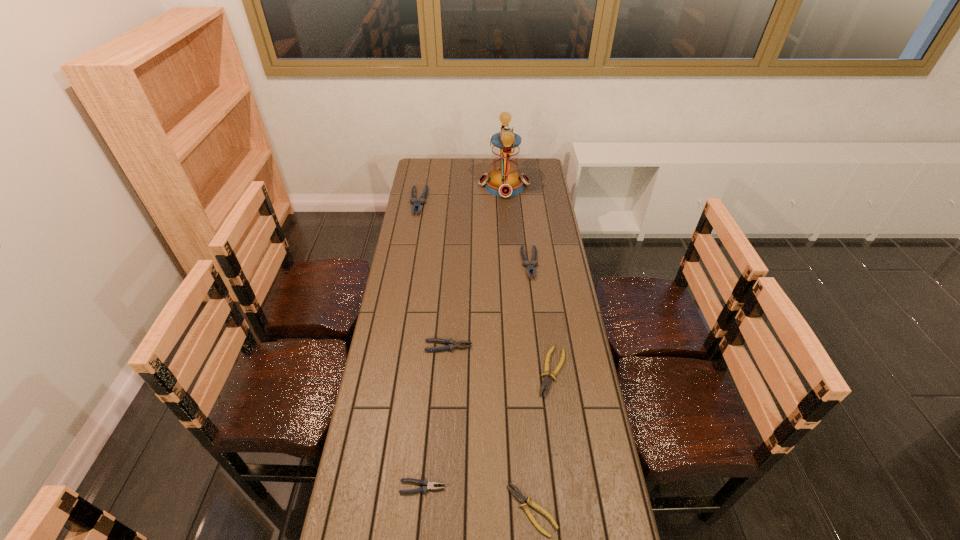
Identify which gray pliers is located as the nearest to the nearest gray pliers. Please provide its 2D coordinates. Your answer should be formatted as a tuple, i.e. [(x, y)], where the tuple contains the x and y coordinates of a point satisfying the conditions above.

[(452, 344)]

This screenshot has width=960, height=540. In order to click on free location that satisfies the following two spatial constraints: 1. at the gripping part of the leftmost pliers; 2. on the left side of the nearer yellow pliers in this screenshot , I will do `click(365, 510)`.

What are the coordinates of `vacant space that satisfies the following two spatial constraints: 1. at the gripping part of the second nearest gray pliers; 2. on the right side of the smaller yellow pliers` in the screenshot? It's located at (438, 510).

Find the location of a particular element. vacant area in the image that satisfies the following two spatial constraints: 1. at the gripping part of the second farthest gray pliers; 2. on the right side of the farther yellow pliers is located at coordinates click(542, 372).

This screenshot has width=960, height=540. I want to click on free space that satisfies the following two spatial constraints: 1. at the gripping part of the fifth shortest object; 2. on the right side of the bigger yellow pliers, so click(x=542, y=372).

The image size is (960, 540). In order to click on vacant space that satisfies the following two spatial constraints: 1. at the gripping part of the leftmost object; 2. on the right side of the bigger yellow pliers in this screenshot , I will do `click(389, 372)`.